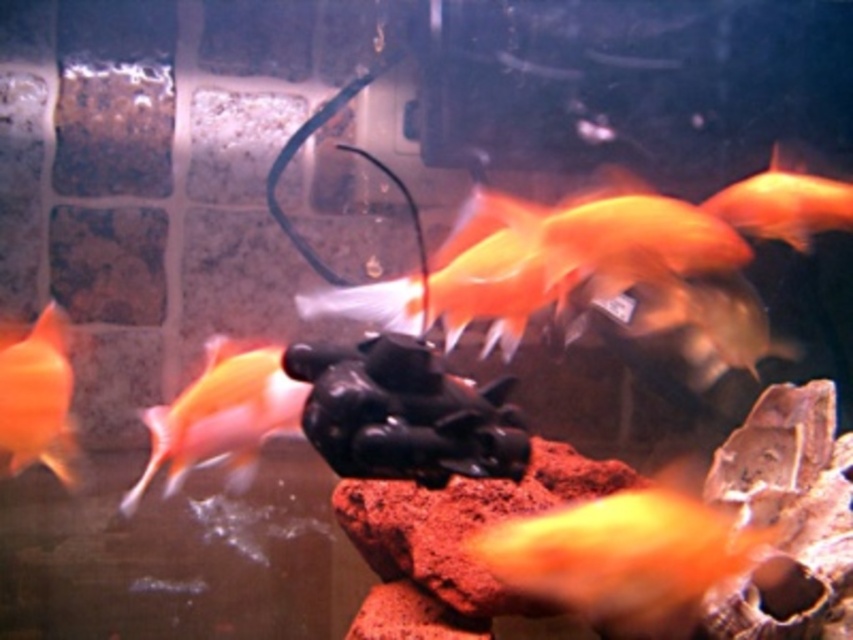
You are an aquarium maintenance worker. You need to identify which fish is smaller between the matte orange fish at left and the orange matte goldfish at upper right. Which one should you report?

The matte orange fish at left is shorter than the orange matte goldfish at upper right, so you should report the matte orange fish at left as the smaller one.